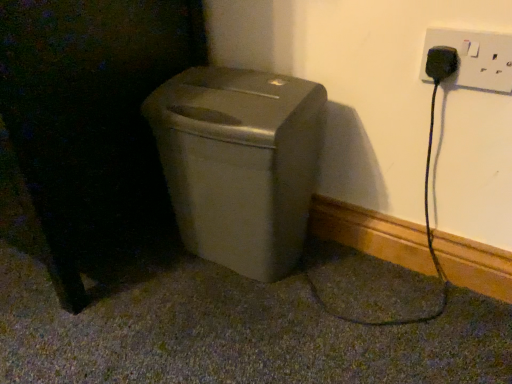
Question: Considering the relative sizes of black matte cat at left and satin beige trash can at center in the image provided, is black matte cat at left smaller than satin beige trash can at center?

Choices:
 (A) yes
 (B) no

Answer: (B)

Question: Can you confirm if black matte cat at left is positioned to the left of satin beige trash can at center?

Choices:
 (A) yes
 (B) no

Answer: (A)

Question: Are black matte cat at left and satin beige trash can at center located far from each other?

Choices:
 (A) yes
 (B) no

Answer: (B)

Question: Considering the relative sizes of black matte cat at left and satin beige trash can at center in the image provided, is black matte cat at left taller than satin beige trash can at center?

Choices:
 (A) no
 (B) yes

Answer: (B)

Question: Is black matte cat at left bigger than satin beige trash can at center?

Choices:
 (A) no
 (B) yes

Answer: (B)

Question: Looking at their shapes, would you say white plastic plug at upper right is wider or thinner than satin beige trash can at center?

Choices:
 (A) thin
 (B) wide

Answer: (A)

Question: From the image's perspective, is white plastic plug at upper right above or below satin beige trash can at center?

Choices:
 (A) below
 (B) above

Answer: (B)

Question: Which is correct: white plastic plug at upper right is inside satin beige trash can at center, or outside of it?

Choices:
 (A) inside
 (B) outside

Answer: (B)

Question: Considering the positions of point (459, 48) and point (242, 172), is point (459, 48) closer or farther from the camera than point (242, 172)?

Choices:
 (A) closer
 (B) farther

Answer: (A)

Question: In terms of size, does satin beige trash can at center appear bigger or smaller than black matte cat at left?

Choices:
 (A) small
 (B) big

Answer: (A)

Question: Considering their positions, is satin beige trash can at center located in front of or behind black matte cat at left?

Choices:
 (A) behind
 (B) front

Answer: (A)

Question: Does point (278, 105) appear closer or farther from the camera than point (79, 241)?

Choices:
 (A) closer
 (B) farther

Answer: (A)

Question: Considering the positions of satin beige trash can at center and black matte cat at left in the image, is satin beige trash can at center wider or thinner than black matte cat at left?

Choices:
 (A) wide
 (B) thin

Answer: (B)

Question: From the image's perspective, is black matte cat at left above or below satin beige trash can at center?

Choices:
 (A) above
 (B) below

Answer: (A)

Question: From a real-world perspective, is black matte cat at left above or below satin beige trash can at center?

Choices:
 (A) above
 (B) below

Answer: (A)